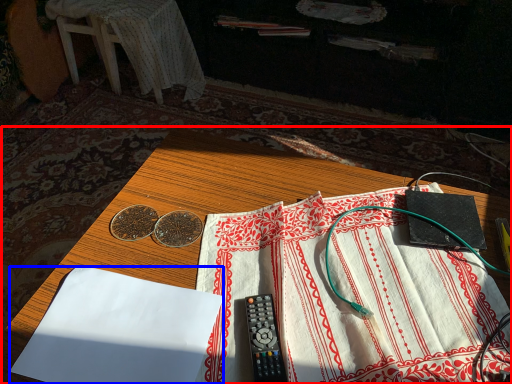
Question: Which object is further to the camera taking this photo, table (highlighted by a red box) or sheet (highlighted by a blue box)?

Choices:
 (A) table
 (B) sheet

Answer: (B)